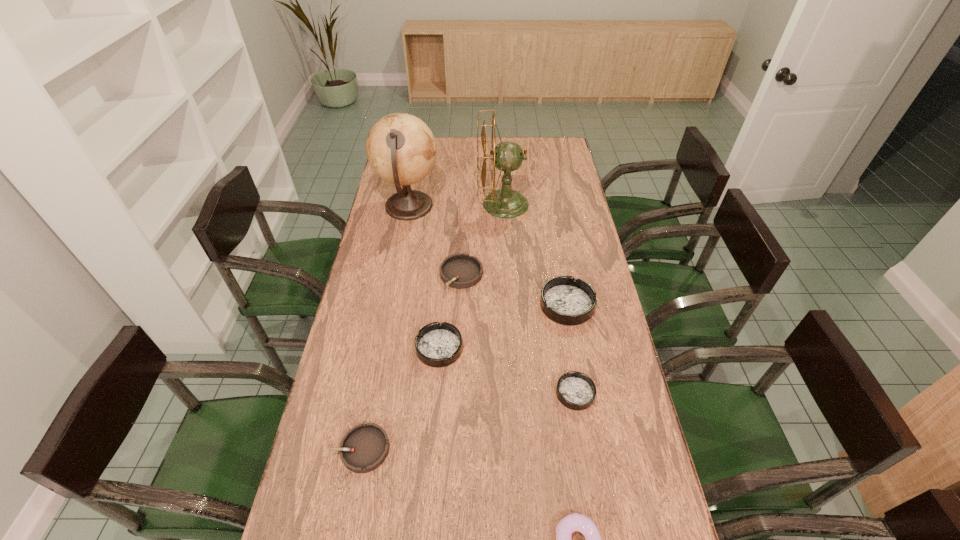
The height and width of the screenshot is (540, 960). I want to click on vacant space that satisfies the following two spatial constraints: 1. on the front-facing side of the globe; 2. on the back side of the leftmost dark ashtray, so (383, 348).

The image size is (960, 540). I want to click on vacant region that satisfies the following two spatial constraints: 1. on the front-facing side of the globe; 2. on the back side of the second nearest dark ashtray, so click(383, 348).

The height and width of the screenshot is (540, 960). In order to click on vacant space that satisfies the following two spatial constraints: 1. on the front-facing side of the globe; 2. on the right side of the farthest dark ashtray in this screenshot , I will do `click(391, 305)`.